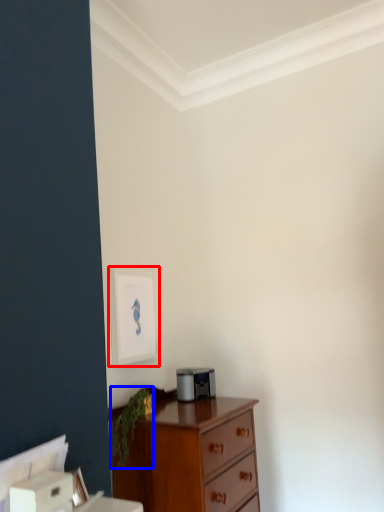
Question: Among these objects, which one is nearest to the camera, picture frame (highlighted by a red box) or plant (highlighted by a blue box)?

Choices:
 (A) picture frame
 (B) plant

Answer: (B)